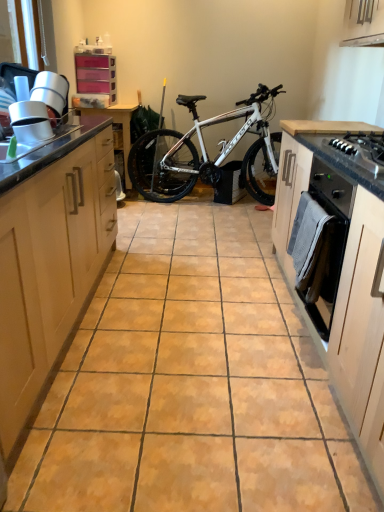
Question: Is the position of black glossy gas stove at right less distant than that of black matte oven at right?

Choices:
 (A) yes
 (B) no

Answer: (A)

Question: Does black glossy gas stove at right have a smaller size compared to black matte oven at right?

Choices:
 (A) yes
 (B) no

Answer: (A)

Question: Does black glossy gas stove at right have a greater height compared to black matte oven at right?

Choices:
 (A) yes
 (B) no

Answer: (B)

Question: From a real-world perspective, is black glossy gas stove at right positioned under black matte oven at right based on gravity?

Choices:
 (A) yes
 (B) no

Answer: (B)

Question: Considering the relative sizes of black glossy gas stove at right and black matte oven at right in the image provided, is black glossy gas stove at right bigger than black matte oven at right?

Choices:
 (A) no
 (B) yes

Answer: (A)

Question: From a real-world perspective, is black matte oven at right above or below wooden table at center?

Choices:
 (A) below
 (B) above

Answer: (B)

Question: Considering the positions of black matte oven at right and wooden table at center in the image, is black matte oven at right bigger or smaller than wooden table at center?

Choices:
 (A) small
 (B) big

Answer: (A)

Question: From the image's perspective, is black matte oven at right located above or below wooden table at center?

Choices:
 (A) below
 (B) above

Answer: (A)

Question: Is point (324, 291) positioned closer to the camera than point (127, 147)?

Choices:
 (A) farther
 (B) closer

Answer: (B)

Question: Considering the positions of black glossy gas stove at right and black matte oven at right in the image, is black glossy gas stove at right wider or thinner than black matte oven at right?

Choices:
 (A) thin
 (B) wide

Answer: (A)

Question: From the image's perspective, is black glossy gas stove at right positioned above or below black matte oven at right?

Choices:
 (A) above
 (B) below

Answer: (A)

Question: In the image, is black glossy gas stove at right on the left side or the right side of black matte oven at right?

Choices:
 (A) left
 (B) right

Answer: (B)

Question: Would you say black glossy gas stove at right is inside or outside black matte oven at right?

Choices:
 (A) inside
 (B) outside

Answer: (B)

Question: Considering the positions of point (342, 151) and point (46, 245), is point (342, 151) closer or farther from the camera than point (46, 245)?

Choices:
 (A) closer
 (B) farther

Answer: (B)

Question: Is black glossy gas stove at right inside the boundaries of light wood cabinet at left, the first cabinetry positioned from the left, or outside?

Choices:
 (A) outside
 (B) inside

Answer: (A)